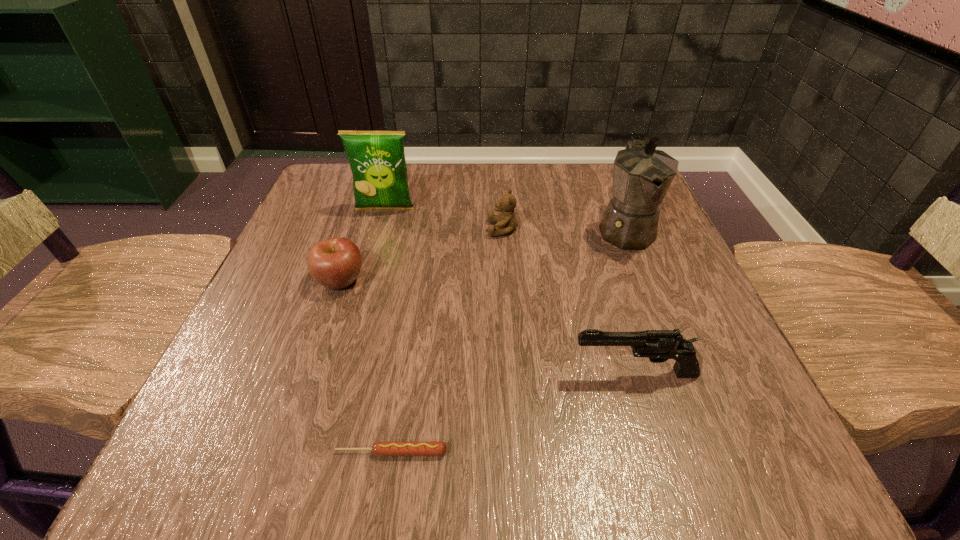
You are a GUI agent. You are given a task and a screenshot of the screen. Output one action in this format:
    pyautogui.click(x=<x>, y=<y>)
    Task: Click on the vacant area that lies between the second tallest object and the apple
    
    Given the screenshot: What is the action you would take?
    pyautogui.click(x=363, y=245)

Locate an element on the screen. The width and height of the screenshot is (960, 540). object that can be found as the fourth closest to the apple is located at coordinates (658, 345).

Select which object is the closest to the teddy bear. Please provide its 2D coordinates. Your answer should be formatted as a tuple, i.e. [(x, y)], where the tuple contains the x and y coordinates of a point satisfying the conditions above.

[(377, 160)]

Where is `free space that satisfies the following two spatial constraints: 1. on the pouring side of the coffeepot; 2. at the end of the barrel of the second nearest object`? The width and height of the screenshot is (960, 540). free space that satisfies the following two spatial constraints: 1. on the pouring side of the coffeepot; 2. at the end of the barrel of the second nearest object is located at coordinates (683, 374).

At what (x,y) coordinates should I click in order to perform the action: click on vacant space that satisfies the following two spatial constraints: 1. on the front-facing side of the sausage; 2. on the right side of the second tallest object. Please return your answer as a coordinate pair (x, y). This screenshot has width=960, height=540. Looking at the image, I should click on (318, 452).

Locate an element on the screen. This screenshot has height=540, width=960. free space that satisfies the following two spatial constraints: 1. on the front-facing side of the sausage; 2. on the left side of the crisp (potato chip) is located at coordinates (318, 452).